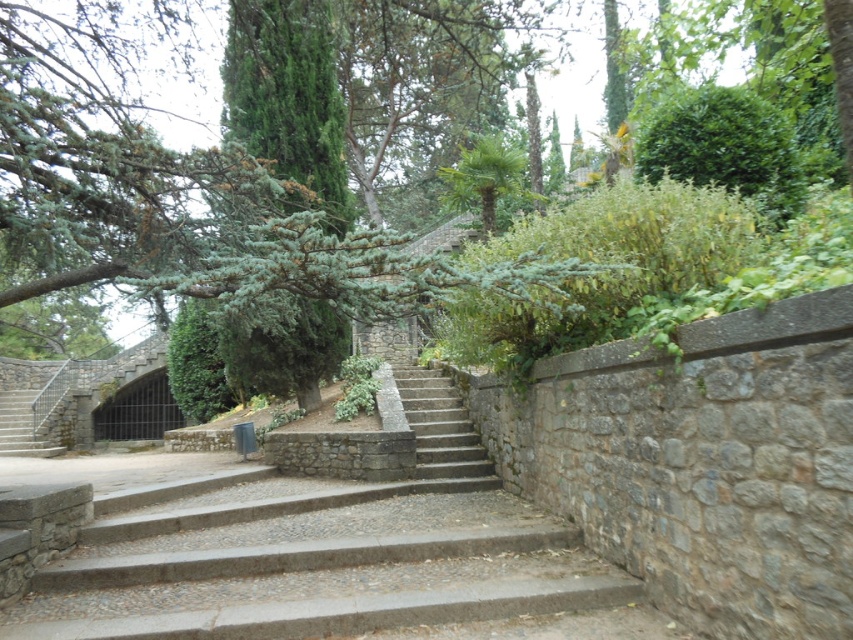
You are a delivery person carrying a large package that is 12 feet long. You need to move it down the gray stone stairs at center. Can you fit the package on the stairs?

The gray stone stairs at center are 11.44 feet apart, which is shorter than the 12 feet length of the package. Therefore, the package cannot fit on the stairs.

You are a landscape architect designing a pathway through this garden. You need to choose between the gray stone stairs at center and the stone steps at center for a section that requires a steeper incline. Which option should you select based on their height?

The stone steps at center have a greater height than the gray stone stairs at center, making them suitable for a steeper incline.